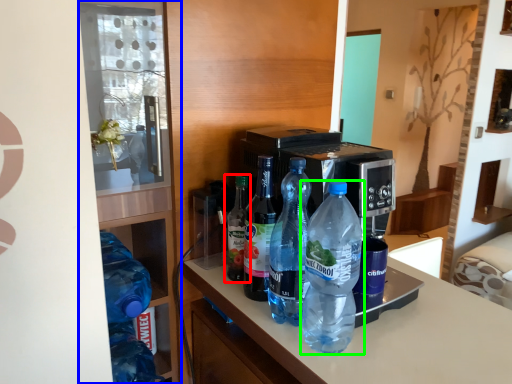
Question: Which is farther away from bottle (highlighted by a red box)? shelf (highlighted by a blue box) or bottle (highlighted by a green box)?

Choices:
 (A) shelf
 (B) bottle

Answer: (B)